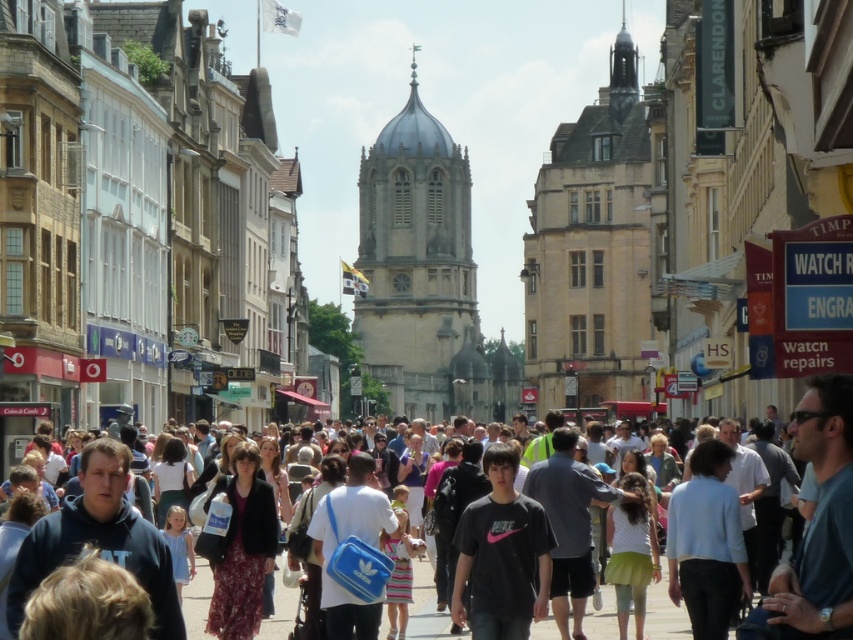
You are standing on the bustling street in front of the stone tower at center. You want to take a photo of the tower with your smartphone, which has a maximum zoom capability of 10x. Considering the distance between you and the tower, can you capture the entire tower in your photo without moving closer?

The distance between you and the stone tower at center is 261.49 meters. Since smartphones typically cannot zoom beyond 10x effectively, which would be insufficient to capture the entire tower from that distance, you would need to move closer to ensure the tower fits in the frame.

You are a tourist standing on the bustling street in Oxford. You see the stone tower at center and the dark gray clothing at center. Which object is higher in the scene?

The stone tower at center is located above dark gray clothing at center, so the stone tower at center is higher in the scene.